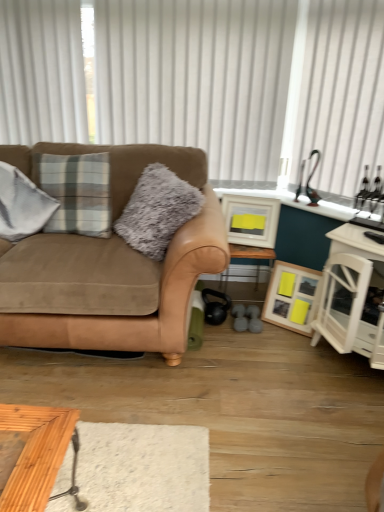
Where is `vacant space in front of wooden table at center`? vacant space in front of wooden table at center is located at coordinates (259, 336).